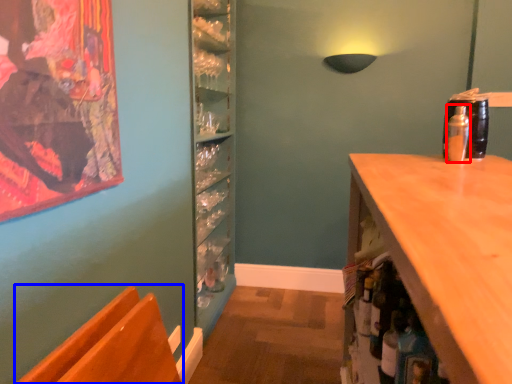
Question: Which of the following is the closest to the observer, bottle (highlighted by a red box) or chair (highlighted by a blue box)?

Choices:
 (A) bottle
 (B) chair

Answer: (B)